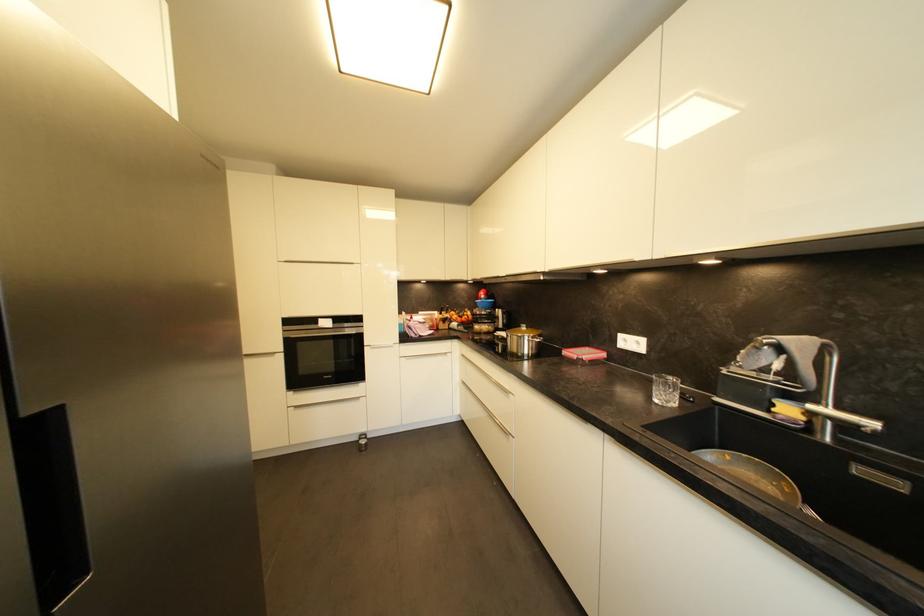
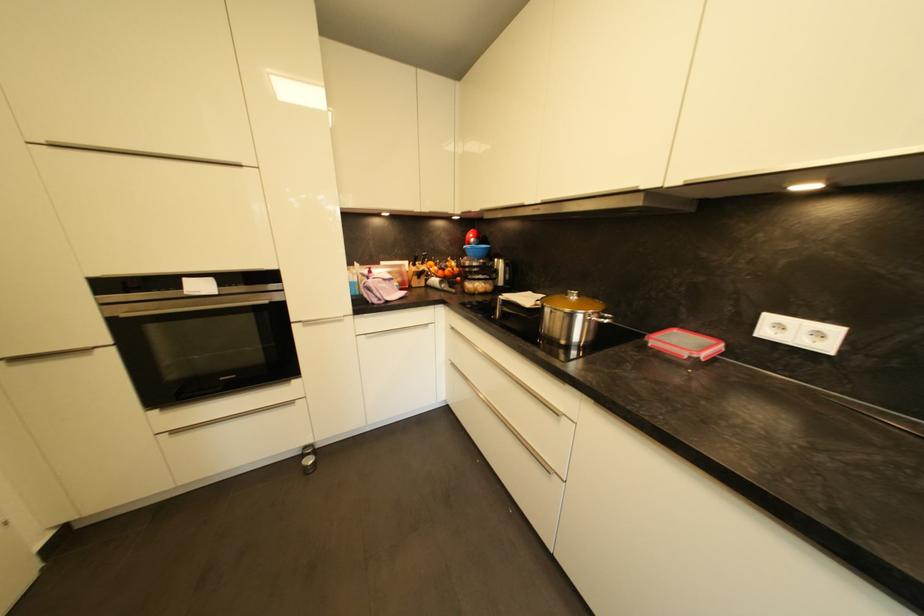
In the second image, find the point that corresponds to point (531, 330) in the first image.

(584, 298)